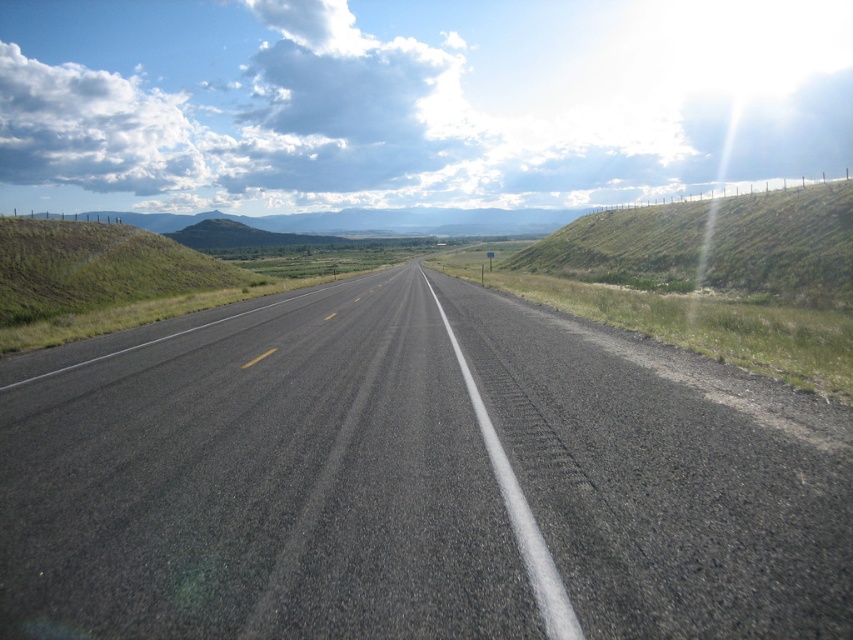
Between point (656, 209) and point (96, 321), which one is positioned behind?

Positioned behind is point (656, 209).

Between point (758, 208) and point (44, 244), which one is positioned in front?

Point (44, 244) is in front.

What are the coordinates of `green grassy hillside at right` in the screenshot? It's located at (714, 246).

Is black asphalt road at center to the right of green grassy hillside at left from the viewer's perspective?

Indeed, black asphalt road at center is positioned on the right side of green grassy hillside at left.

Does black asphalt road at center have a lesser height compared to green grassy hillside at left?

Yes, black asphalt road at center is shorter than green grassy hillside at left.

Find the location of a particular element. black asphalt road at center is located at coordinates (413, 477).

Which of these two, black asphalt road at center or green grassy hillside at right, stands taller?

Standing taller between the two is green grassy hillside at right.

Is point (512, 564) positioned before point (808, 204)?

Yes.

At what (x,y) coordinates should I click in order to perform the action: click on black asphalt road at center. Please return your answer as a coordinate pair (x, y). Image resolution: width=853 pixels, height=640 pixels. Looking at the image, I should click on (413, 477).